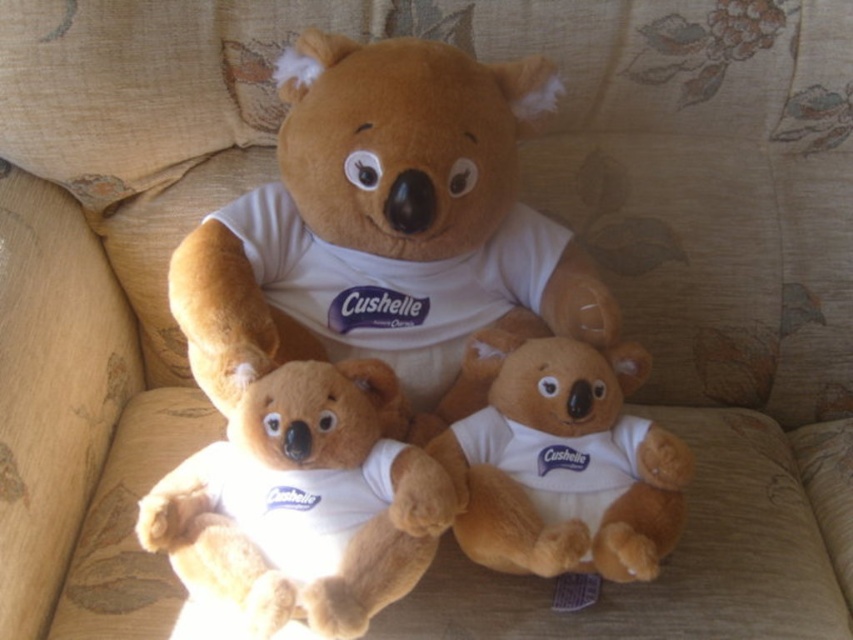
Between white soft t-shirt at center and soft plush bear at center, which one appears on the right side from the viewer's perspective?

Positioned to the right is white soft t-shirt at center.

Is white soft t-shirt at center below soft plush bear at center?

Incorrect, white soft t-shirt at center is not positioned below soft plush bear at center.

Which is in front, point (431, 230) or point (403, 579)?

Positioned in front is point (403, 579).

Identify the location of white soft t-shirt at center. The height and width of the screenshot is (640, 853). (386, 227).

Consider the image. Is white soft t-shirt at center thinner than soft plush teddy bear at center?

No.

Looking at this image, can you confirm if white soft t-shirt at center is wider than soft plush teddy bear at center?

Indeed, white soft t-shirt at center has a greater width compared to soft plush teddy bear at center.

Locate an element on the screen. The width and height of the screenshot is (853, 640). white soft t-shirt at center is located at coordinates (386, 227).

Describe the element at coordinates (302, 502) in the screenshot. I see `soft plush bear at center` at that location.

Is point (354, 634) positioned behind point (560, 417)?

No.

Find the location of `soft plush bear at center`. soft plush bear at center is located at coordinates (302, 502).